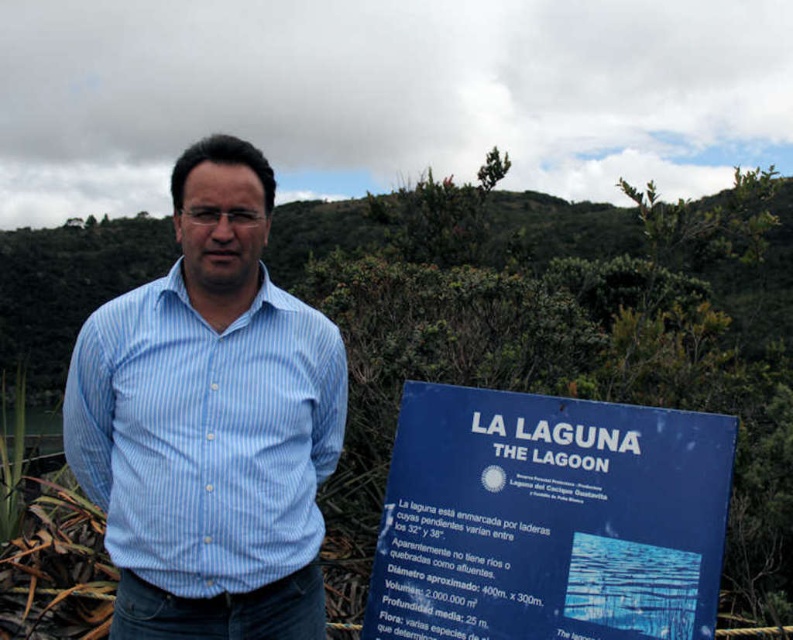
You are a tourist who wants to take a photo of the blue plastic sign at center while also including the blue striped shirt at center in the frame. Based on their positions, which object should you focus on first to ensure both are in the shot?

You should focus on the blue plastic sign at center first because it is to the right of the blue striped shirt at center, so positioning the camera to include both would require framing from the shirt towards the sign.

In the scene shown: You are a photographer positioned at the camera. You notice two points in the image labeled as point [389,600] and point [313,529]. Which point is closer to your current position?

Point [313,529] is closer to your current position because it is in front of point [389,600], which is behind it.